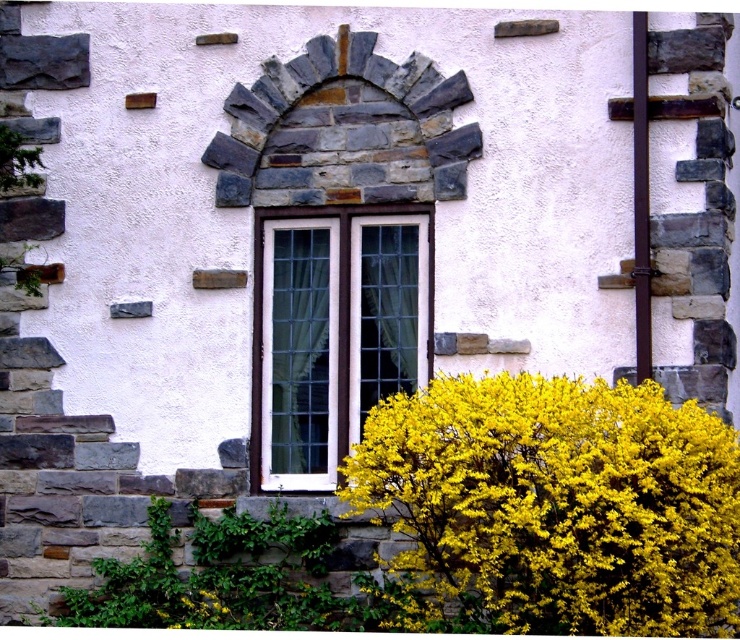
You are standing in front of the building and want to touch the white glass window at center. Is the yellow fluffy bush at lower right blocking your direct path to the window?

The yellow fluffy bush at lower right is closer to the viewer than the white glass window at center, so it is blocking the direct path to the window.

You are standing in front of the building and notice the yellow fluffy bush at lower right and the white glass window at center. Which object is located below the other?

The yellow fluffy bush at lower right is positioned under the white glass window at center.

You are standing in front of the building and see the white glass window at center and the yellow fluffy bush at lower right. Which object is positioned to the right of the other?

The yellow fluffy bush at lower right is positioned to the right of the white glass window at center.